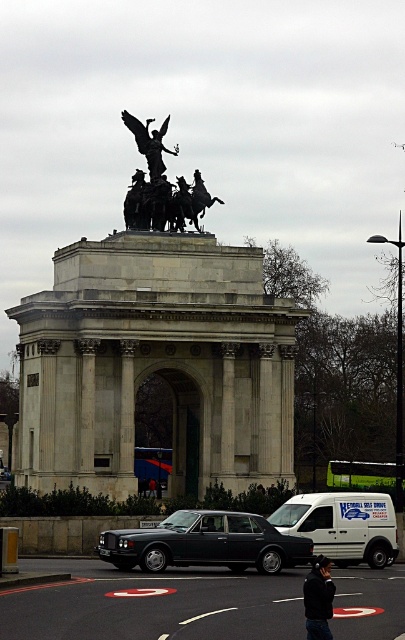
Does white matte van at center appear over bronze statue at center?

Incorrect, white matte van at center is not positioned above bronze statue at center.

Which is in front, point (390, 545) or point (208, 204)?

Point (390, 545)

The height and width of the screenshot is (640, 405). I want to click on white matte van at center, so click(343, 525).

Which is more to the right, shiny black car at center or polished bronze statue at upper center?

shiny black car at center

Is point (181, 532) in front of point (149, 140)?

Yes, point (181, 532) is closer to viewer.

Is point (245, 518) farther from viewer compared to point (121, 113)?

No, it is in front of (121, 113).

Locate an element on the screen. shiny black car at center is located at coordinates (204, 544).

Who is more forward, (134,129) or (313,568)?

Point (313,568) is in front.

In the scene shown: Who is taller, bronze statue at center or black fabric jacket at lower center?

bronze statue at center is taller.

Describe the element at coordinates (161, 186) in the screenshot. The width and height of the screenshot is (405, 640). I see `bronze statue at center` at that location.

You are a GUI agent. You are given a task and a screenshot of the screen. Output one action in this format:
    pyautogui.click(x=<x>, y=<y>)
    Task: Click on the bronze statue at center
    Image resolution: width=405 pixels, height=640 pixels.
    Given the screenshot: What is the action you would take?
    pyautogui.click(x=161, y=186)